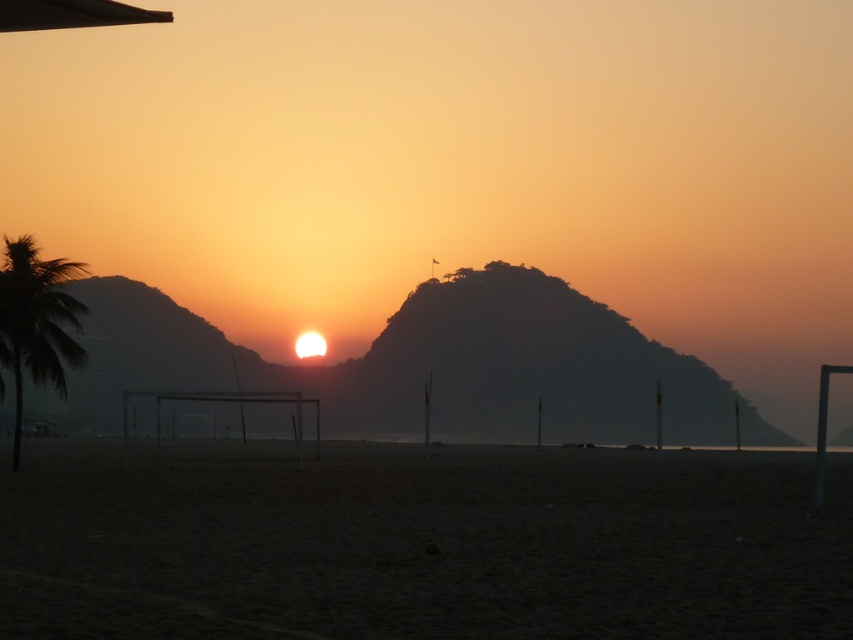
Is dark sand at lower center taller than green leafy palm tree at left?

Incorrect, dark sand at lower center's height is not larger of green leafy palm tree at left's.

Image resolution: width=853 pixels, height=640 pixels. Describe the element at coordinates (421, 545) in the screenshot. I see `dark sand at lower center` at that location.

The image size is (853, 640). I want to click on dark sand at lower center, so click(x=421, y=545).

Is dark sand at lower center in front of silhouette rock at center?

Yes, dark sand at lower center is closer to the viewer.

Does dark sand at lower center appear under silhouette rock at center?

Indeed, dark sand at lower center is positioned under silhouette rock at center.

Does point (289, 616) come closer to viewer compared to point (183, 358)?

Yes.

This screenshot has height=640, width=853. I want to click on dark sand at lower center, so click(x=421, y=545).

Describe the element at coordinates (439, 364) in the screenshot. I see `silhouette rock at center` at that location.

Is point (479, 312) positioned behind point (13, 321)?

Yes.

Image resolution: width=853 pixels, height=640 pixels. In order to click on silhouette rock at center in this screenshot , I will do `click(439, 364)`.